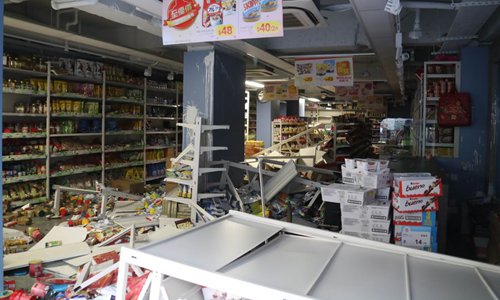
Locate an element on the screen. blue pillar is located at coordinates (207, 91), (479, 160).